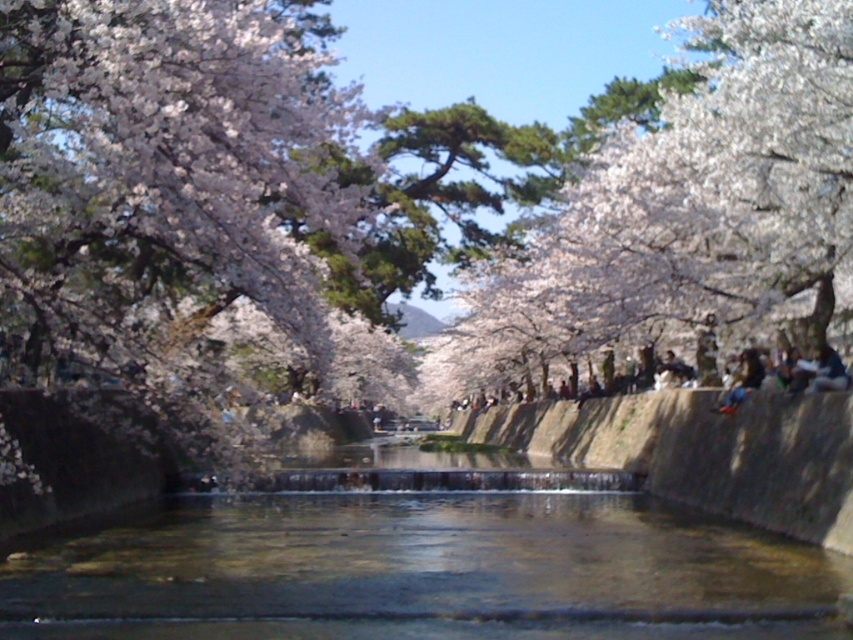
You are standing at the edge of the canal and want to throw a stone into the water. You have two points marked on the water surface where you want to aim. Which point is closer to you, point [619,172] or point [700,428]?

Point [700,428] is closer to you because it is less further to the camera than point [619,172].

Based on the photo, you are standing at the center of the canal and want to locate the white blossoming tree at upper left. According to the coordinates provided, in which direction should you look to find it?

The white blossoming tree at upper left is located at point coordinates, so you should look to the upper left direction to find it.

You are an artist planning to paint the canal scene. You want to ensure the clear water at center is visible behind the white blossoming tree at upper left. Based on the scene, is this arrangement possible?

Yes, the arrangement is possible because the clear water at center is described as being behind the white blossoming tree at upper left, allowing the water to be visible through or beyond the tree in the painting.